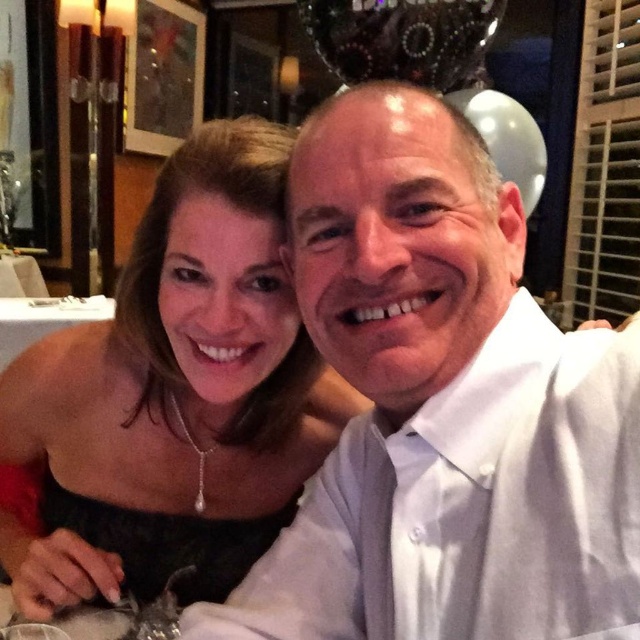
You are a photographer at a social event and need to adjust lighting based on the size of clothing items. The white smooth shirt at center and the black satin dress at upper left are in your frame. Which clothing item requires more focused lighting due to its larger size?

The white smooth shirt at center requires more focused lighting because it is larger than the black satin dress at upper left.